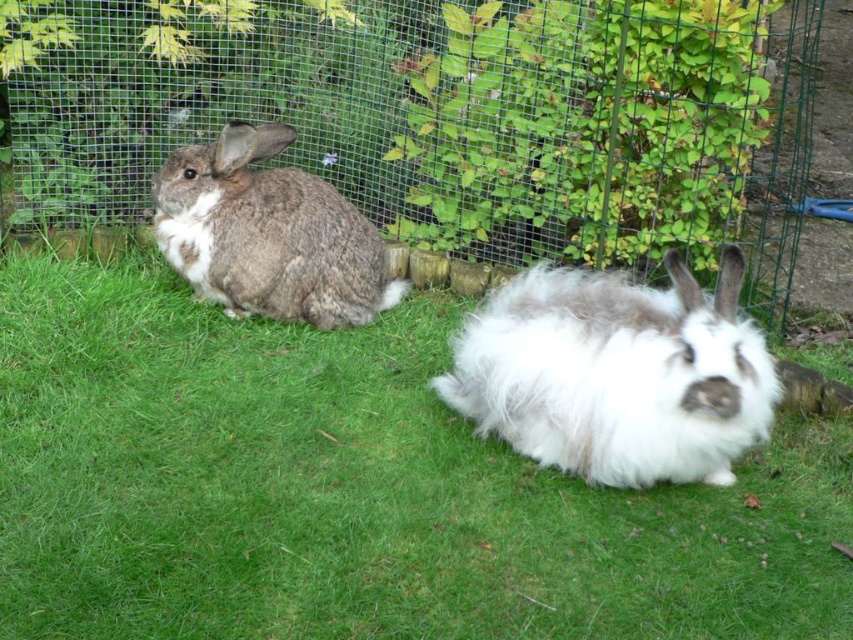
Question: Is green grass at center smaller than gray fluffy rabbit at left?

Choices:
 (A) no
 (B) yes

Answer: (A)

Question: Which point is closer to the camera?

Choices:
 (A) fluffy white rabbit at center
 (B) green wire mesh at center
 (C) gray fluffy rabbit at left
 (D) green grass at center

Answer: (D)

Question: Is fluffy white rabbit at center thinner than gray fluffy rabbit at left?

Choices:
 (A) yes
 (B) no

Answer: (B)

Question: Is green grass at center in front of gray fluffy rabbit at left?

Choices:
 (A) no
 (B) yes

Answer: (B)

Question: Which object is farther from the camera taking this photo?

Choices:
 (A) gray fluffy rabbit at left
 (B) green wire mesh at center

Answer: (B)

Question: Which point is closer to the camera?

Choices:
 (A) fluffy white rabbit at center
 (B) green wire mesh at center
 (C) green grass at center

Answer: (C)